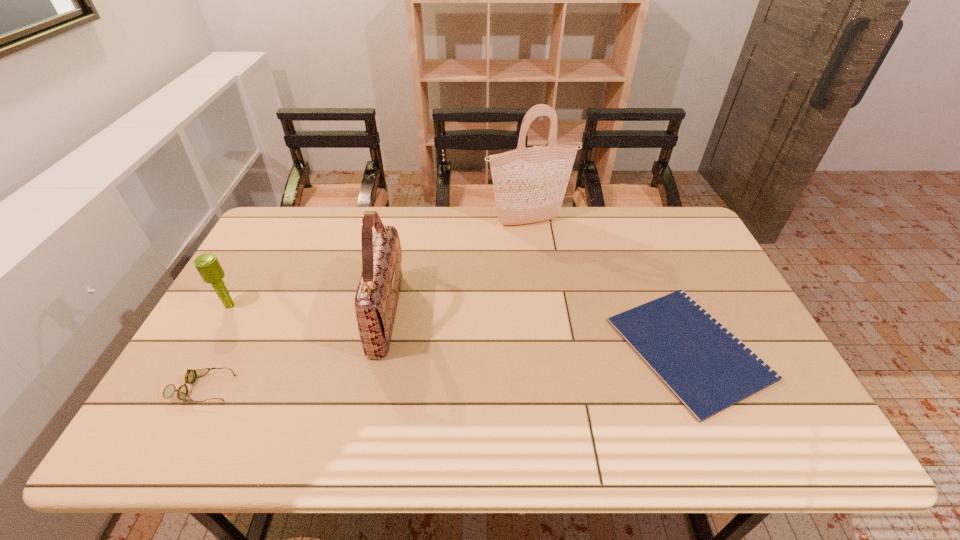
Where is `the third closest object to the spectacles`? This screenshot has height=540, width=960. the third closest object to the spectacles is located at coordinates (529, 184).

Find the location of `vacant space that satisfies the following two spatial constraints: 1. on the back side of the farthest object; 2. on the left side of the microphone`. vacant space that satisfies the following two spatial constraints: 1. on the back side of the farthest object; 2. on the left side of the microphone is located at coordinates (277, 221).